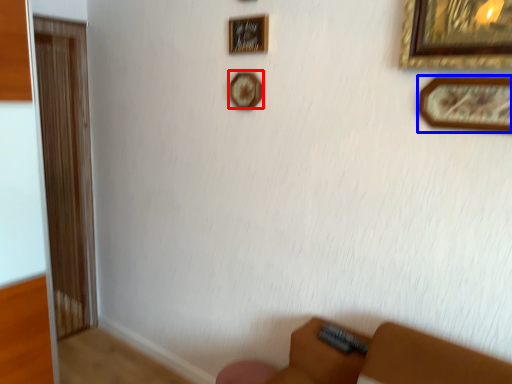
Question: Which object appears farthest to the camera in this image, picture frame (highlighted by a red box) or picture frame (highlighted by a blue box)?

Choices:
 (A) picture frame
 (B) picture frame

Answer: (A)